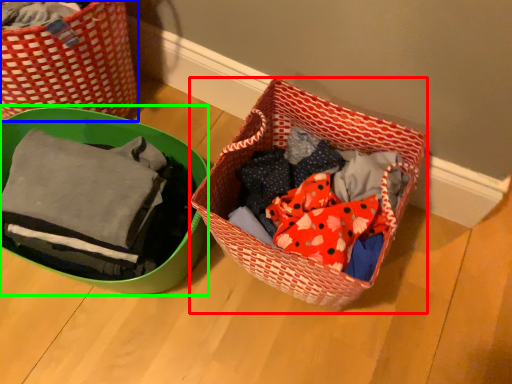
Question: Considering the real-world distances, which object is closest to picnic basket (highlighted by a red box)? picnic basket (highlighted by a blue box) or gift basket (highlighted by a green box).

Choices:
 (A) picnic basket
 (B) gift basket

Answer: (B)